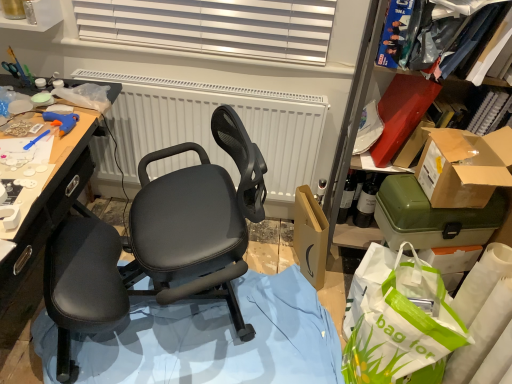
Question: In terms of width, does brown cardboard box at right, which is the 2th box from bottom to top, look wider or thinner when compared to white textured radiator at center?

Choices:
 (A) wide
 (B) thin

Answer: (A)

Question: Considering the positions of brown cardboard box at right, which is the 2th box from bottom to top, and white textured radiator at center in the image, is brown cardboard box at right, which is the 2th box from bottom to top, taller or shorter than white textured radiator at center?

Choices:
 (A) short
 (B) tall

Answer: (A)

Question: Estimate the real-world distances between objects in this image. Which object is closer to the green plastic container at right, which ranks as the 2th box in top-to-bottom order?

Choices:
 (A) white textured radiator at center
 (B) matte black office chair at center
 (C) brown cardboard box at right, which appears as the first box when viewed from the top

Answer: (C)

Question: Which object is positioned closest to the green plastic container at right, which ranks as the 2th box in top-to-bottom order?

Choices:
 (A) white textured radiator at center
 (B) matte black office chair at center
 (C) brown cardboard box at right, which is the 2th box from bottom to top

Answer: (C)